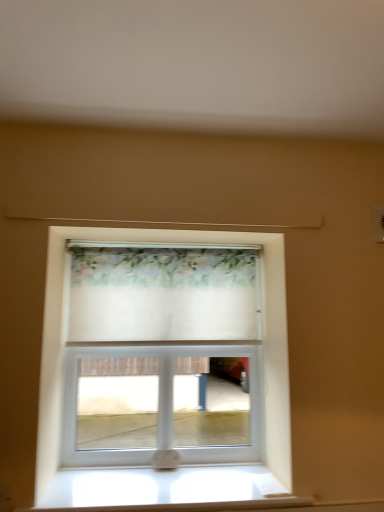
Question: Is white wood window sill at lower center facing towards floral sheer curtain at center?

Choices:
 (A) yes
 (B) no

Answer: (B)

Question: From a real-world perspective, is white wood window sill at lower center under floral sheer curtain at center?

Choices:
 (A) no
 (B) yes

Answer: (B)

Question: Is white wood window sill at lower center positioned beyond the bounds of floral sheer curtain at center?

Choices:
 (A) no
 (B) yes

Answer: (B)

Question: From a real-world perspective, is white wood window sill at lower center over floral sheer curtain at center?

Choices:
 (A) no
 (B) yes

Answer: (A)

Question: Is white wood window sill at lower center positioned in front of floral sheer curtain at center?

Choices:
 (A) no
 (B) yes

Answer: (B)

Question: Is point (198, 336) closer or farther from the camera than point (284, 364)?

Choices:
 (A) farther
 (B) closer

Answer: (A)

Question: Is floral sheer curtain at center taller or shorter than white fabric at center?

Choices:
 (A) tall
 (B) short

Answer: (B)

Question: Do you think floral sheer curtain at center is within white fabric at center, or outside of it?

Choices:
 (A) inside
 (B) outside

Answer: (B)

Question: Is floral sheer curtain at center bigger or smaller than white fabric at center?

Choices:
 (A) small
 (B) big

Answer: (A)

Question: From a real-world perspective, is floral sheer curtain at center positioned above or below white wood window sill at lower center?

Choices:
 (A) below
 (B) above

Answer: (B)

Question: Based on their sizes in the image, would you say floral sheer curtain at center is bigger or smaller than white wood window sill at lower center?

Choices:
 (A) big
 (B) small

Answer: (A)

Question: From the image's perspective, is floral sheer curtain at center above or below white wood window sill at lower center?

Choices:
 (A) above
 (B) below

Answer: (A)

Question: Would you say floral sheer curtain at center is to the left or to the right of white wood window sill at lower center in the picture?

Choices:
 (A) right
 (B) left

Answer: (B)

Question: In terms of width, does white wood window sill at lower center look wider or thinner when compared to floral sheer curtain at center?

Choices:
 (A) thin
 (B) wide

Answer: (B)

Question: Is white wood window sill at lower center situated inside floral sheer curtain at center or outside?

Choices:
 (A) inside
 (B) outside

Answer: (B)